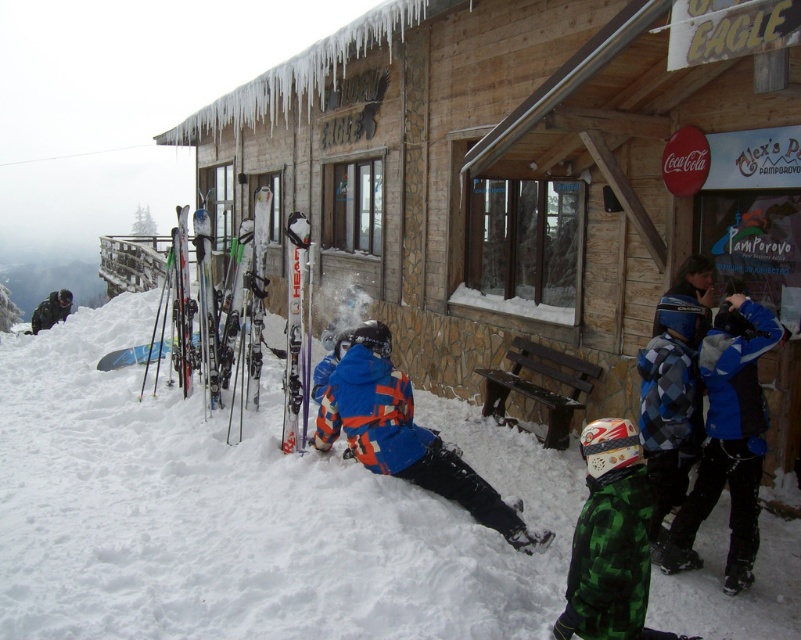
Does blue checkered jacket at lower right have a lesser height compared to shiny metallic ski at left?

Yes.

How distant is blue checkered jacket at lower right from shiny metallic ski at left?

blue checkered jacket at lower right is 5.19 meters away from shiny metallic ski at left.

Locate an element on the screen. blue checkered jacket at lower right is located at coordinates (671, 397).

From the picture: Which is more to the left, white metallic ski at center or matte black skis at left?

matte black skis at left

Can you confirm if white metallic ski at center is thinner than matte black skis at left?

Indeed, white metallic ski at center has a lesser width compared to matte black skis at left.

Is point (300, 260) behind point (184, 228)?

No, it is not.

Locate an element on the screen. This screenshot has height=640, width=801. white metallic ski at center is located at coordinates (294, 326).

Is point (530, 531) less distant than point (296, 288)?

Yes.

Can you confirm if blue plaid snowboard at center is positioned below white metallic ski at center?

Correct, blue plaid snowboard at center is located below white metallic ski at center.

Where is `blue plaid snowboard at center`? blue plaid snowboard at center is located at coordinates (405, 436).